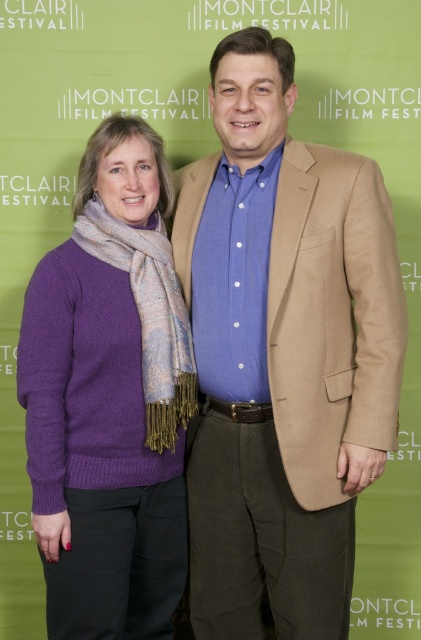
Based on the photo, you are a costume designer preparing for a play. You need to decide which garment to use for a scene that requires a larger piece of clothing. Based on the image, which item between the matte beige blazer at center and the purple wool sweater at left should you choose?

The matte beige blazer at center is bigger than the purple wool sweater at left, so you should choose the matte beige blazer at center for the scene requiring a larger piece of clothing.

You are designing a poster for the Montclair Film Festival and need to ensure proper proportions between the matte beige blazer at center and the purple wool sweater at left. Given their height difference, which object should be placed higher on the poster to maintain visual balance?

The matte beige blazer at center should be placed higher on the poster because it is much taller than the purple wool sweater at left, so positioning it higher can help balance the visual weight between the two objects.